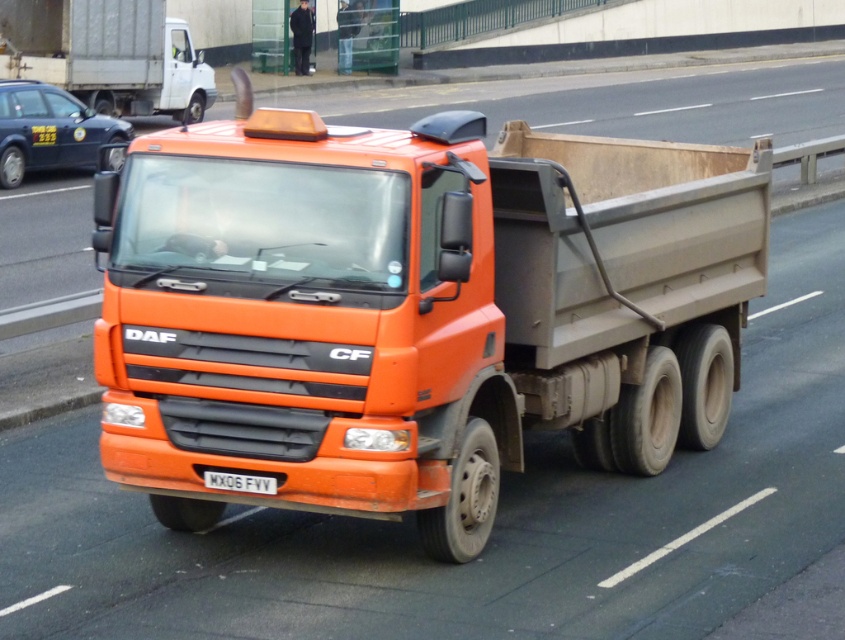
Is metallic blue taxi at left smaller than white metallic license plate at center?

No, metallic blue taxi at left is not smaller than white metallic license plate at center.

Does metallic blue taxi at left appear under white metallic license plate at center?

Incorrect, metallic blue taxi at left is not positioned below white metallic license plate at center.

The height and width of the screenshot is (640, 845). Describe the element at coordinates (48, 131) in the screenshot. I see `metallic blue taxi at left` at that location.

Where is `metallic blue taxi at left`? The height and width of the screenshot is (640, 845). metallic blue taxi at left is located at coordinates (48, 131).

Measure the distance between point (582, 305) and camera.

Point (582, 305) is 8.18 meters away from camera.

Can you confirm if orange matte truck at center is positioned to the right of metallic blue taxi at left?

Indeed, orange matte truck at center is positioned on the right side of metallic blue taxi at left.

This screenshot has width=845, height=640. Describe the element at coordinates (413, 308) in the screenshot. I see `orange matte truck at center` at that location.

At what (x,y) coordinates should I click in order to perform the action: click on orange matte truck at center. Please return your answer as a coordinate pair (x, y). The height and width of the screenshot is (640, 845). Looking at the image, I should click on (413, 308).

What do you see at coordinates (413, 308) in the screenshot? I see `orange matte truck at center` at bounding box center [413, 308].

Who is more forward, (582, 435) or (118, 72)?

Positioned in front is point (582, 435).

What do you see at coordinates (413, 308) in the screenshot? The height and width of the screenshot is (640, 845). I see `orange matte truck at center` at bounding box center [413, 308].

The image size is (845, 640). I want to click on orange matte truck at center, so tap(413, 308).